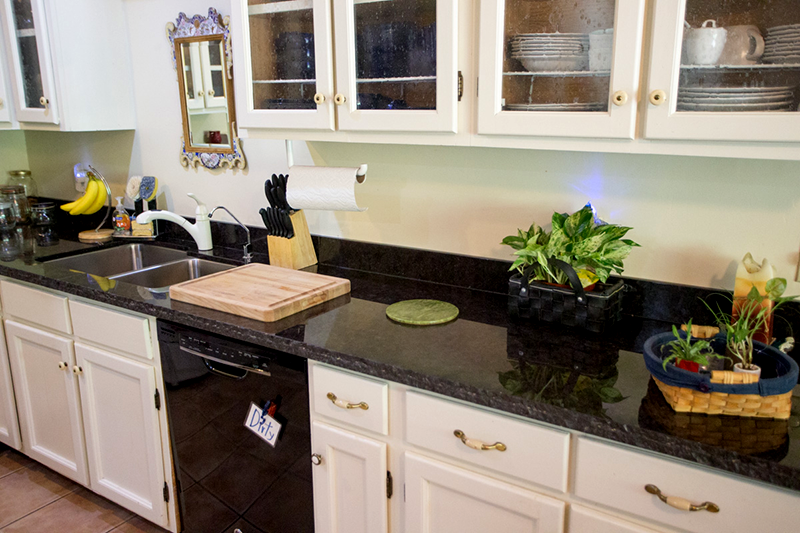
Find the location of `golden handles`. golden handles is located at coordinates point(681,500), point(482,448), point(352,405).